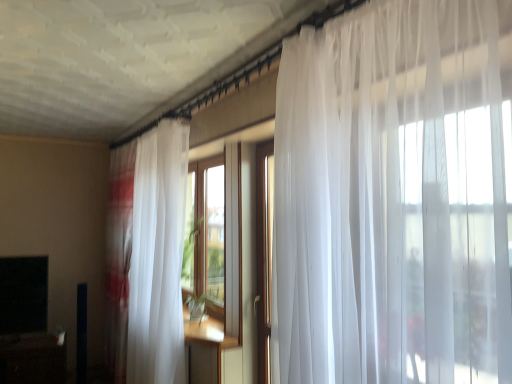
Question: Should I look upward or downward to see black matte tv at lower left?

Choices:
 (A) up
 (B) down

Answer: (B)

Question: Does sheer white curtain at left have a smaller size compared to black glossy table at lower left?

Choices:
 (A) no
 (B) yes

Answer: (A)

Question: Is sheer white curtain at left wider than black glossy table at lower left?

Choices:
 (A) no
 (B) yes

Answer: (A)

Question: From a real-world perspective, is sheer white curtain at left under black glossy table at lower left?

Choices:
 (A) yes
 (B) no

Answer: (B)

Question: Could you tell me if sheer white curtain at left is turned towards black glossy table at lower left?

Choices:
 (A) no
 (B) yes

Answer: (B)

Question: Is sheer white curtain at left looking in the opposite direction of black glossy table at lower left?

Choices:
 (A) no
 (B) yes

Answer: (A)

Question: Considering the relative positions of sheer white curtain at left and black glossy table at lower left in the image provided, is sheer white curtain at left behind black glossy table at lower left?

Choices:
 (A) yes
 (B) no

Answer: (B)

Question: Is black matte tv at lower left a part of black glossy table at lower left?

Choices:
 (A) yes
 (B) no

Answer: (B)

Question: Does black glossy table at lower left appear on the left side of black matte tv at lower left?

Choices:
 (A) yes
 (B) no

Answer: (B)

Question: Is black glossy table at lower left positioned in front of black matte tv at lower left?

Choices:
 (A) yes
 (B) no

Answer: (A)

Question: Can you confirm if black glossy table at lower left is taller than black matte tv at lower left?

Choices:
 (A) yes
 (B) no

Answer: (B)

Question: Does black glossy table at lower left have a larger size compared to black matte tv at lower left?

Choices:
 (A) yes
 (B) no

Answer: (A)

Question: From the image's perspective, is black glossy table at lower left on top of black matte tv at lower left?

Choices:
 (A) yes
 (B) no

Answer: (B)

Question: Is black matte tv at lower left in contact with sheer white curtain at left?

Choices:
 (A) no
 (B) yes

Answer: (A)